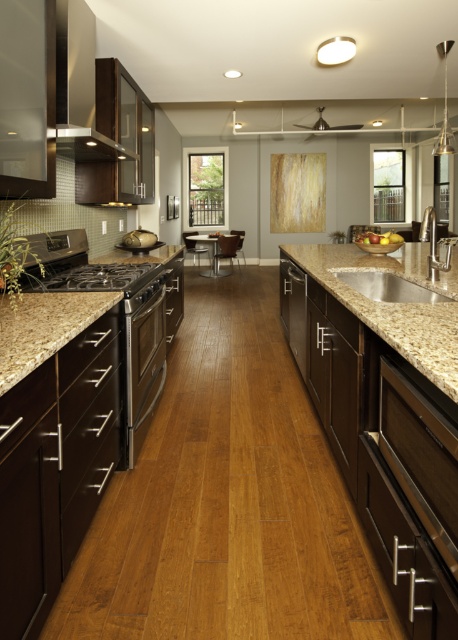
Is granite countertop at left below stainless steel oven at center?

No.

Is granite countertop at left positioned at the back of stainless steel oven at center?

No, granite countertop at left is closer to the viewer.

Is point (37, 362) farther from viewer compared to point (163, 324)?

No, (37, 362) is in front of (163, 324).

You are a GUI agent. You are given a task and a screenshot of the screen. Output one action in this format:
    pyautogui.click(x=<x>, y=<y>)
    Task: Click on the granite countertop at left
    
    Given the screenshot: What is the action you would take?
    pyautogui.click(x=43, y=326)

Does point (134, 381) come behind point (130, 435)?

Yes, it is behind point (130, 435).

Can you confirm if stainless steel oven at left is positioned to the right of stainless steel oven at center?

In fact, stainless steel oven at left is to the left of stainless steel oven at center.

Find the location of `stainless steel oven at left`. stainless steel oven at left is located at coordinates (90, 272).

Can you confirm if stainless steel exhaust hood at upper left is taller than stainless steel oven at center?

No, stainless steel exhaust hood at upper left is not taller than stainless steel oven at center.

Does stainless steel exhaust hood at upper left appear under stainless steel oven at center?

Actually, stainless steel exhaust hood at upper left is above stainless steel oven at center.

Where is `stainless steel exhaust hood at upper left`? This screenshot has height=640, width=458. stainless steel exhaust hood at upper left is located at coordinates (80, 81).